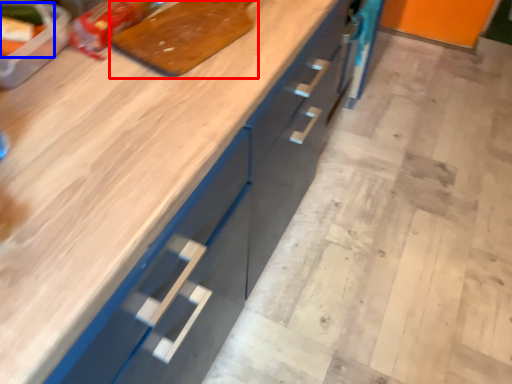
Question: Among these objects, which one is farthest to the camera, cutting board (highlighted by a red box) or food (highlighted by a blue box)?

Choices:
 (A) cutting board
 (B) food

Answer: (A)